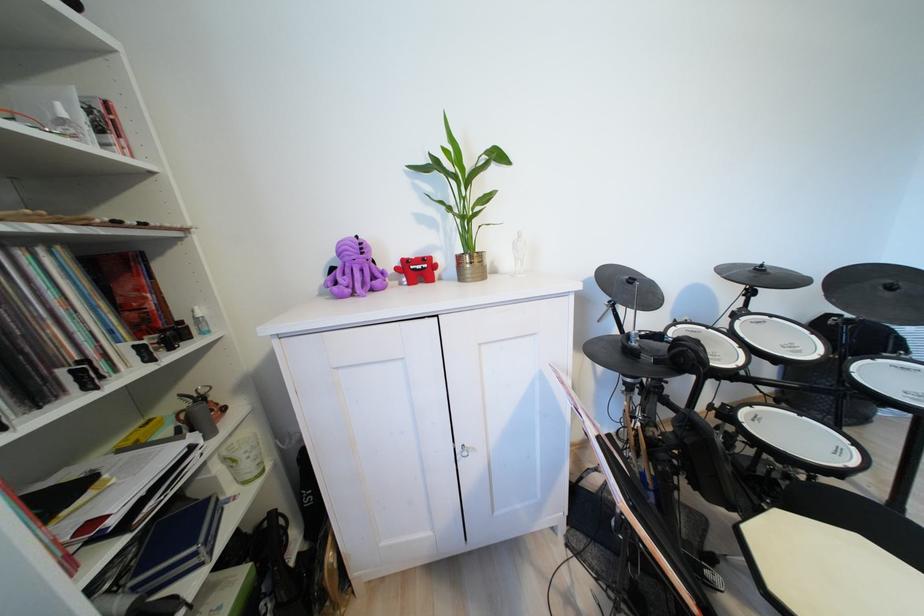
Which object does [354,270] point to?

This point indicates the purple octopus toy.